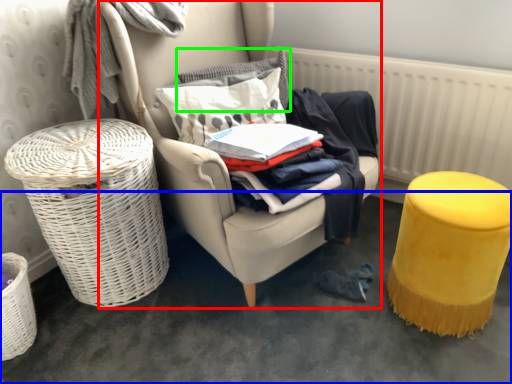
Question: Which object is positioned farthest from chair (highlighted by a red box)? Select from concrete (highlighted by a blue box) and pillow (highlighted by a green box).

Choices:
 (A) concrete
 (B) pillow

Answer: (A)